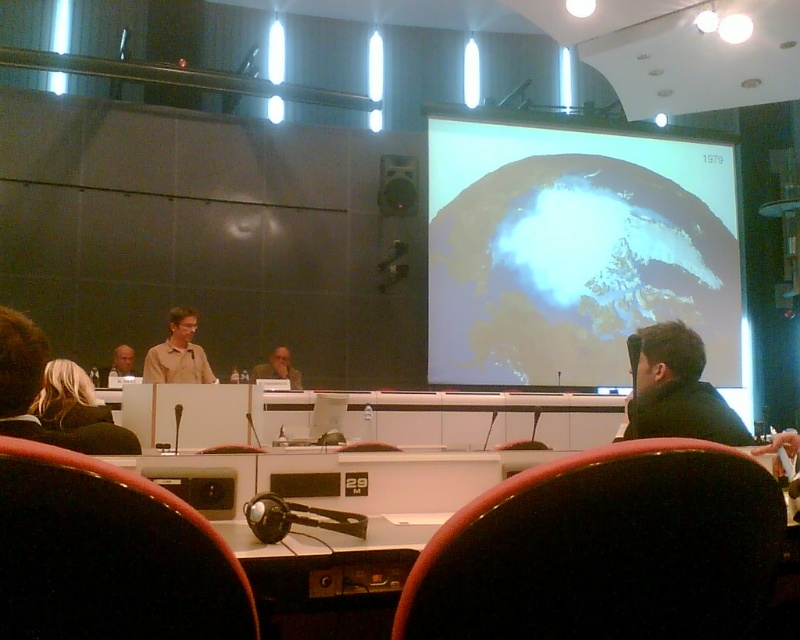
You are sitting in the back row of the conference room and want to ask a question to the speaker. Which person should you direct your question towards, the matte brown shirt at left or the matte beige shirt at center?

You should direct your question to the matte beige shirt at center because the matte brown shirt at left is closer to the viewer and thus further away from the speaker located at the front. Wait, this might be conflicting. Let me think again. The description says matte brown shirt at left is closer to the viewer than matte beige shirt at center. If the viewer is in the back row, then the person closer to the viewer would be in front, so the matte brown shirt is closer to the viewer meaning they are in front